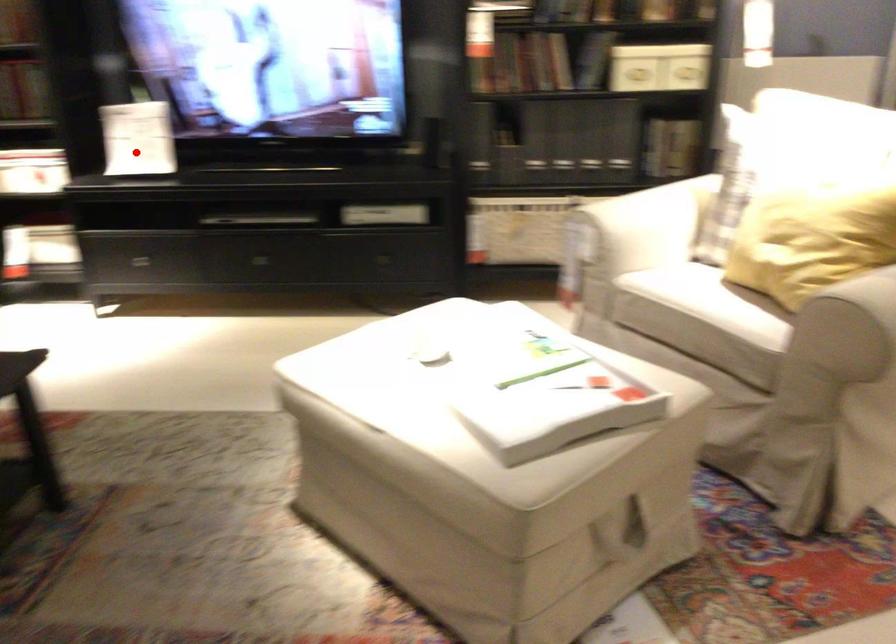
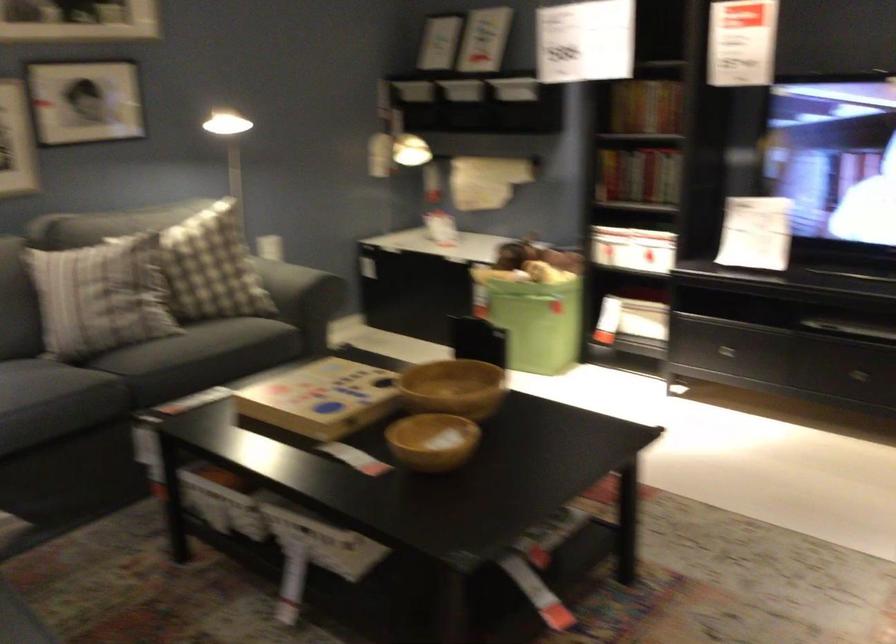
In the second image, find the point that corresponds to the highlighted location in the first image.

(755, 232)